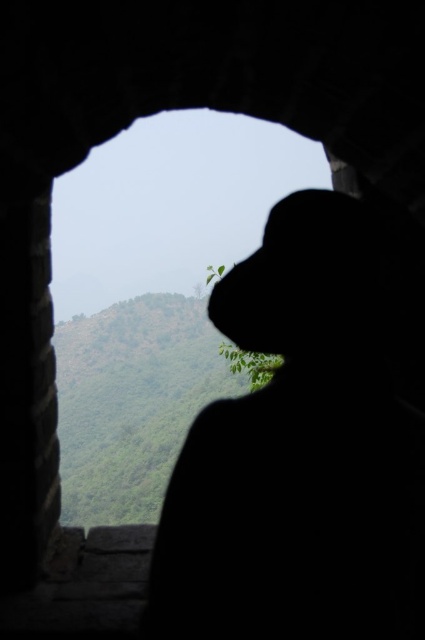
Question: Where is silhouette hat at center located in relation to transparent glass window at center in the image?

Choices:
 (A) above
 (B) below

Answer: (B)

Question: Which point appears farthest from the camera in this image?

Choices:
 (A) (90, 172)
 (B) (391, 310)

Answer: (A)

Question: Does silhouette hat at center appear over transparent glass window at center?

Choices:
 (A) no
 (B) yes

Answer: (A)

Question: Is silhouette hat at center smaller than transparent glass window at center?

Choices:
 (A) yes
 (B) no

Answer: (A)